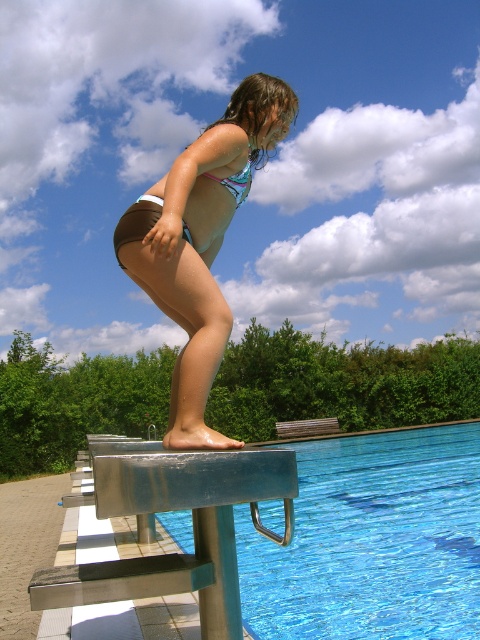
You are a lifeguard standing on the pool deck. You need to retrieve an object from the water. The blue glassy water at center and the matte blue bikini at center are both in your line of sight. Which object is farther away from you?

The blue glassy water at center and the matte blue bikini at center are 26.50 feet apart from each other. Since the bikini is on the diving board and the water is at the pool bottom, the blue glassy water at center is farther away from you.

Consider the image. You are a lifeguard on duty and see the blue glassy water at center and the matte blue bikini at center. Which object is positioned lower in the image?

The blue glassy water at center is positioned lower than the matte blue bikini at center.

You are a swim instructor and need to place two bikinis on the pool deck for a demonstration. The pool deck has a checkered pattern with tiles alternating light and dark. The two bikinis are the matte blue bikini at center and the pink shiny bikini at center. If you want to place them so that they are exactly 24.44 inches apart, can you do that on the checkered tiles?

The matte blue bikini at center is 24.44 inches away from the pink shiny bikini at center, so yes, you can place them exactly 24.44 inches apart on the checkered tiles as specified.